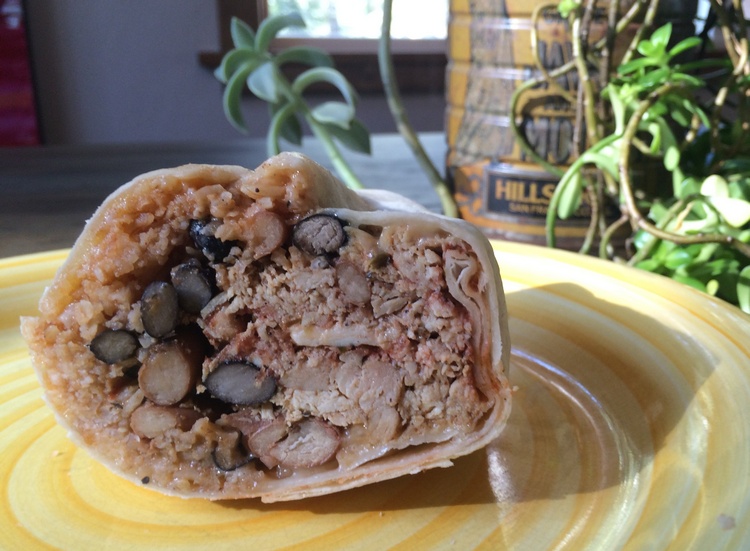
I want to click on window sill, so click(346, 48).